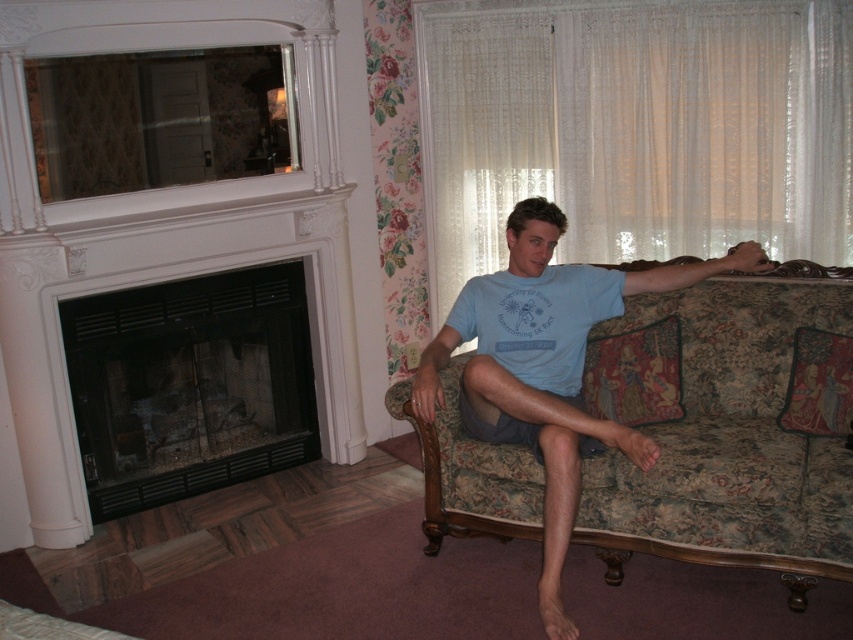
Question: Which object is closer to the camera taking this photo?

Choices:
 (A) floral fabric couch at right
 (B) black glass fireplace at left

Answer: (A)

Question: Which point appears closest to the camera in this image?

Choices:
 (A) (831, 528)
 (B) (163, 305)

Answer: (A)

Question: Can you confirm if floral fabric couch at right is positioned below black glass fireplace at left?

Choices:
 (A) yes
 (B) no

Answer: (A)

Question: Is floral fabric couch at right positioned at the back of black glass fireplace at left?

Choices:
 (A) no
 (B) yes

Answer: (A)

Question: Is floral fabric couch at right smaller than black glass fireplace at left?

Choices:
 (A) yes
 (B) no

Answer: (B)